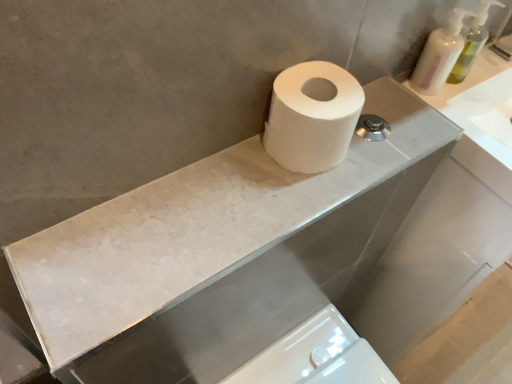
Question: From the image's perspective, is white matte toilet paper at center below translucent plastic soap dispenser at upper right, which is the 1th soap dispenser from right to left?

Choices:
 (A) no
 (B) yes

Answer: (B)

Question: Considering the relative sizes of white matte toilet paper at center and translucent plastic soap dispenser at upper right, which is the 1th soap dispenser from right to left, in the image provided, is white matte toilet paper at center taller than translucent plastic soap dispenser at upper right, which is the 1th soap dispenser from right to left,?

Choices:
 (A) yes
 (B) no

Answer: (B)

Question: Are white matte toilet paper at center and translucent plastic soap dispenser at upper right, which is the 2th soap dispenser from left to right, making contact?

Choices:
 (A) no
 (B) yes

Answer: (A)

Question: Is white matte toilet paper at center surrounding translucent plastic soap dispenser at upper right, which is the 2th soap dispenser from left to right?

Choices:
 (A) no
 (B) yes

Answer: (A)

Question: Does white matte toilet paper at center come in front of translucent plastic soap dispenser at upper right, which is the 2th soap dispenser from left to right?

Choices:
 (A) yes
 (B) no

Answer: (A)

Question: Is white matte toilet paper at center thinner than translucent plastic soap dispenser at upper right, which is the 2th soap dispenser from left to right?

Choices:
 (A) no
 (B) yes

Answer: (A)

Question: Is white marble counter top at upper center surrounded by white glossy bidet at lower center?

Choices:
 (A) no
 (B) yes

Answer: (A)

Question: Can you confirm if white glossy bidet at lower center is thinner than white marble counter top at upper center?

Choices:
 (A) yes
 (B) no

Answer: (B)

Question: Considering the relative sizes of white glossy bidet at lower center and white marble counter top at upper center in the image provided, is white glossy bidet at lower center bigger than white marble counter top at upper center?

Choices:
 (A) no
 (B) yes

Answer: (B)

Question: Is white glossy bidet at lower center next to white marble counter top at upper center?

Choices:
 (A) no
 (B) yes

Answer: (A)

Question: From a real-world perspective, is white glossy bidet at lower center over white marble counter top at upper center?

Choices:
 (A) no
 (B) yes

Answer: (A)

Question: Is white glossy bidet at lower center at the left side of white marble counter top at upper center?

Choices:
 (A) no
 (B) yes

Answer: (A)

Question: Is white matte toilet paper at center turned away from white marble counter top at upper center?

Choices:
 (A) yes
 (B) no

Answer: (B)